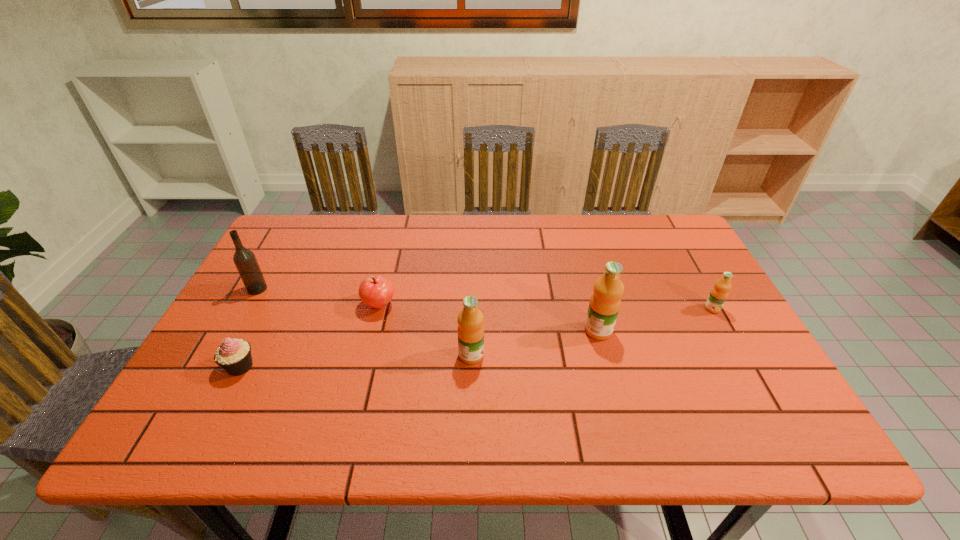
Identify the location of vacant space at the far edge. This screenshot has width=960, height=540. (523, 219).

The height and width of the screenshot is (540, 960). What are the coordinates of `free space at the near edge of the desktop` in the screenshot? It's located at (658, 375).

The width and height of the screenshot is (960, 540). In the image, there is a desktop. Identify the location of free region at the left edge. (210, 369).

Where is `free space at the right edge of the desktop`? free space at the right edge of the desktop is located at coordinates (741, 337).

Locate an element on the screen. The width and height of the screenshot is (960, 540). free region at the near left corner of the desktop is located at coordinates coord(193,400).

Locate an element on the screen. free space at the near right corner is located at coordinates (743, 383).

Image resolution: width=960 pixels, height=540 pixels. In order to click on empty space that is in between the fourth farthest object and the cupcake in this screenshot , I will do `click(420, 348)`.

Where is `free point between the nearest orange juice and the fourth object from right to left`? The image size is (960, 540). free point between the nearest orange juice and the fourth object from right to left is located at coordinates (425, 330).

Find the location of a particular element. free space between the rightmost orange juice and the vodka is located at coordinates (485, 299).

You are a GUI agent. You are given a task and a screenshot of the screen. Output one action in this format:
    pyautogui.click(x=<x>, y=<y>)
    Task: Click on the vacant space that is in between the farthest orange juice and the vodka
    This screenshot has width=960, height=540.
    Given the screenshot: What is the action you would take?
    pyautogui.click(x=485, y=299)